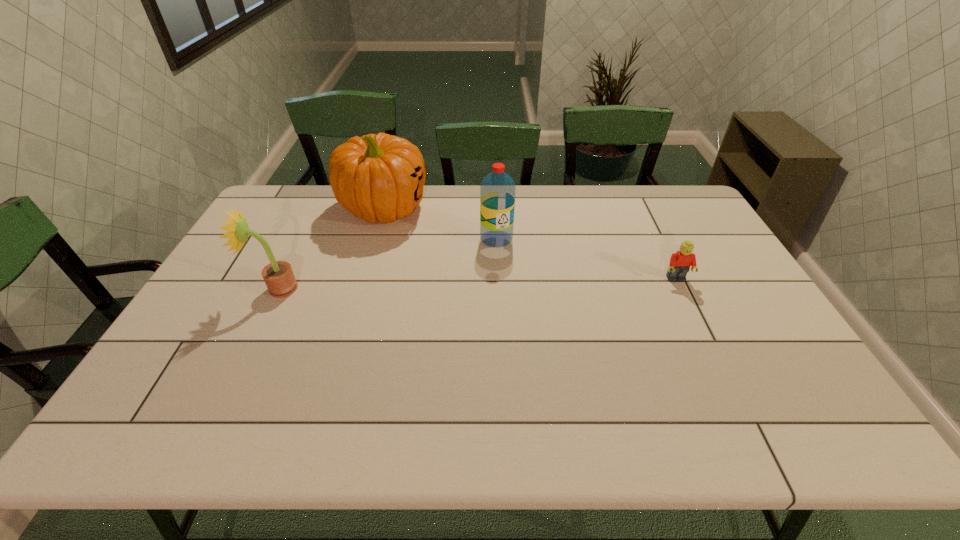
In the image, there is a desktop. Where is `vacant space at the right edge`? Image resolution: width=960 pixels, height=540 pixels. vacant space at the right edge is located at coordinates (727, 282).

The image size is (960, 540). In the image, there is a desktop. What are the coordinates of `vacant space at the near left corner` in the screenshot? It's located at (207, 374).

You are a GUI agent. You are given a task and a screenshot of the screen. Output one action in this format:
    pyautogui.click(x=<x>, y=<y>)
    Task: Click on the vacant region at the far right corner of the desktop
    
    Given the screenshot: What is the action you would take?
    pyautogui.click(x=650, y=201)

What are the coordinates of `vacant space at the near right corner of the desktop` in the screenshot? It's located at click(776, 370).

Locate an element on the screen. free spot between the sunflower and the third object from right to left is located at coordinates (330, 248).

At what (x,y) coordinates should I click in order to perform the action: click on free spot between the third object from right to left and the leftmost object. Please return your answer as a coordinate pair (x, y). The width and height of the screenshot is (960, 540). Looking at the image, I should click on (330, 248).

At what (x,y) coordinates should I click in order to perform the action: click on free space between the sunflower and the water bottle. Please return your answer as a coordinate pair (x, y). Looking at the image, I should click on (387, 264).

Where is `vacant space that's between the rightmost object and the pumpkin`? vacant space that's between the rightmost object and the pumpkin is located at coordinates (529, 244).

The image size is (960, 540). In order to click on vacant area that lies between the rightmost object and the sunflower in this screenshot , I will do `click(477, 284)`.

Find the location of a particular element. The width and height of the screenshot is (960, 540). blank region between the second object from right to left and the shortest object is located at coordinates (587, 259).